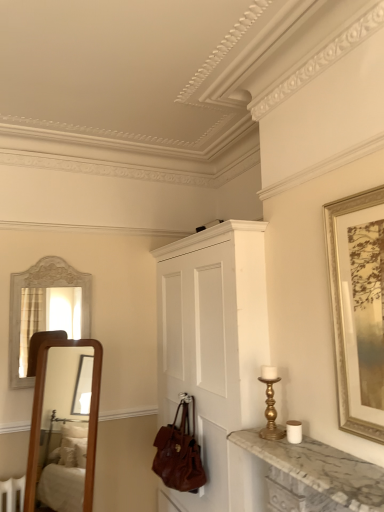
The image size is (384, 512). What do you see at coordinates (321, 468) in the screenshot?
I see `marble at right` at bounding box center [321, 468].

Locate an element on the screen. The height and width of the screenshot is (512, 384). marble at right is located at coordinates pos(321,468).

Describe the element at coordinates (358, 308) in the screenshot. I see `gold-framed artwork at right` at that location.

Where is `gold-framed artwork at right`? This screenshot has width=384, height=512. gold-framed artwork at right is located at coordinates (x=358, y=308).

What do you see at coordinates (213, 349) in the screenshot?
I see `white painted wood cabinet at center` at bounding box center [213, 349].

The height and width of the screenshot is (512, 384). I want to click on brown leather handbag at lower center, so click(x=179, y=454).

Considering the positions of points (361, 256) and (273, 381), is point (361, 256) closer to camera compared to point (273, 381)?

Yes, point (361, 256) is closer to viewer.

From the image's perspective, is gold-framed artwork at right located beneath gold metallic candle holder at right?

No, from the image's perspective, gold-framed artwork at right is not below gold metallic candle holder at right.

Is gold-framed artwork at right inside or outside of gold metallic candle holder at right?

gold-framed artwork at right lies outside gold metallic candle holder at right.

Between gold-framed artwork at right and gold metallic candle holder at right, which one has less height?

Standing shorter between the two is gold metallic candle holder at right.

Can you tell me how much marble at right and gold metallic candle holder at right differ in facing direction?

The angle between the facing direction of marble at right and the facing direction of gold metallic candle holder at right is 0.538 degrees.

Which of these two, marble at right or gold metallic candle holder at right, is wider?

Wider between the two is marble at right.

From the image's perspective, does marble at right appear higher than gold metallic candle holder at right?

Incorrect, from the image's perspective, marble at right is lower than gold metallic candle holder at right.

Which is in front, point (271, 457) or point (273, 397)?

The point (271, 457) is more forward.

From a real-world perspective, between marble at right and gold-framed artwork at right, who is vertically lower?

In real-world perspective, marble at right is lower.

From the picture: Is marble at right aimed at gold-framed artwork at right?

No, marble at right is not oriented towards gold-framed artwork at right.

From the image's perspective, which object appears higher, marble at right or gold-framed artwork at right?

gold-framed artwork at right.

Which is nearer, (345, 486) or (338, 343)?

Point (345, 486) is closer to the camera than point (338, 343).

How much distance is there between gold-framed artwork at right and marble at right?

gold-framed artwork at right is 15.94 inches from marble at right.

From the image's perspective, is gold-framed artwork at right located above or below marble at right?

Clearly, from the image's perspective, gold-framed artwork at right is above marble at right.

Is gold-framed artwork at right in front of or behind marble at right in the image?

Clearly, gold-framed artwork at right is behind marble at right.

How different are the orientations of gold-framed artwork at right and marble at right in degrees?

There is a 0.221-degree angle between the facing directions of gold-framed artwork at right and marble at right.

From a real-world perspective, is brown leather handbag at lower center physically above white painted wood cabinet at center?

Actually, brown leather handbag at lower center is physically below white painted wood cabinet at center in the real world.

Which is behind, brown leather handbag at lower center or white painted wood cabinet at center?

brown leather handbag at lower center is behind.

Is brown leather handbag at lower center wider than white painted wood cabinet at center?

No, brown leather handbag at lower center is not wider than white painted wood cabinet at center.

Considering the sizes of brown leather handbag at lower center and white painted wood cabinet at center in the image, is brown leather handbag at lower center taller or shorter than white painted wood cabinet at center?

Considering their sizes, brown leather handbag at lower center has less height than white painted wood cabinet at center.

From the image's perspective, is marble at right over white painted wood cabinet at center?

Yes, from the image's perspective, marble at right is over white painted wood cabinet at center.

Is marble at right further to camera compared to white painted wood cabinet at center?

No, marble at right is closer to the viewer.

From a real-world perspective, relative to white painted wood cabinet at center, is marble at right vertically above or below?

From a real-world perspective, marble at right is physically below white painted wood cabinet at center.

How different are the orientations of gold metallic candle holder at right and gold-framed artwork at right in degrees?

The angular difference between gold metallic candle holder at right and gold-framed artwork at right is 0.759 degrees.

Measure the distance from gold metallic candle holder at right to gold-framed artwork at right.

The distance of gold metallic candle holder at right from gold-framed artwork at right is 21.63 inches.

Locate an element on the screen. picture frame that is above the gold metallic candle holder at right (from the image's perspective) is located at coordinates (358, 308).

Would you consider gold metallic candle holder at right to be distant from gold-framed artwork at right?

That's not correct — gold metallic candle holder at right is a little close to gold-framed artwork at right.

You are a GUI agent. You are given a task and a screenshot of the screen. Output one action in this format:
    pyautogui.click(x=<x>, y=<y>)
    Task: Click on the candle holder on the left side of gold-framed artwork at right
    The image size is (384, 512).
    Given the screenshot: What is the action you would take?
    pyautogui.click(x=270, y=405)

At what (x,y) coordinates should I click in order to perform the action: click on countertop below the gold metallic candle holder at right (from the image's perspective). Please return your answer as a coordinate pair (x, y). This screenshot has width=384, height=512. Looking at the image, I should click on (321, 468).

Estimate the real-world distances between objects in this image. Which object is closer to gold metallic candle holder at right, marble at right or white painted wood cabinet at center?

marble at right.

From the image, which object appears to be nearer to white painted wood cabinet at center, gold metallic candle holder at right or gold-framed artwork at right?

Based on the image, gold metallic candle holder at right appears to be nearer to white painted wood cabinet at center.

From the image, which object appears to be farther from marble at right, white painted wood cabinet at center or gold-framed artwork at right?

white painted wood cabinet at center lies further to marble at right than the other object.

From the image, which object appears to be farther from marble at right, gold metallic candle holder at right or gold-framed artwork at right?

gold-framed artwork at right is positioned further to the anchor marble at right.

Looking at the image, which one is located further to white painted wood cabinet at center, marble at right or brown leather handbag at lower center?

marble at right lies further to white painted wood cabinet at center than the other object.

Looking at this image, estimate the real-world distances between objects in this image. Which object is further from marble at right, white painted wood cabinet at center or gold metallic candle holder at right?

Among the two, white painted wood cabinet at center is located further to marble at right.

Consider the image. Looking at the image, which one is located further to marble at right, brown leather handbag at lower center or white painted wood cabinet at center?

brown leather handbag at lower center.

When comparing their distances from brown leather handbag at lower center, does gold-framed artwork at right or white painted wood cabinet at center seem further?

Among the two, gold-framed artwork at right is located further to brown leather handbag at lower center.

Where is `candle holder between gold-framed artwork at right and brown leather handbag at lower center from top to bottom`? The height and width of the screenshot is (512, 384). candle holder between gold-framed artwork at right and brown leather handbag at lower center from top to bottom is located at coordinates (270, 405).

Find the location of a particular element. The width and height of the screenshot is (384, 512). candle holder between marble at right and brown leather handbag at lower center along the z-axis is located at coordinates (270, 405).

Locate an element on the screen. This screenshot has width=384, height=512. cabinetry between brown leather handbag at lower center and gold metallic candle holder at right is located at coordinates (213, 349).

In order to click on cabinetry between gold-framed artwork at right and brown leather handbag at lower center in the vertical direction in this screenshot , I will do `click(213, 349)`.